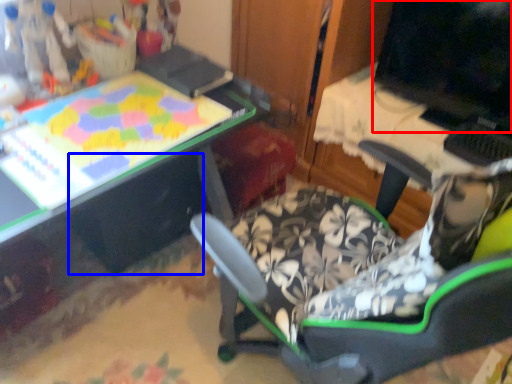
Question: Among these objects, which one is nearest to the camera, computer monitor (highlighted by a red box) or drawer (highlighted by a blue box)?

Choices:
 (A) computer monitor
 (B) drawer

Answer: (A)